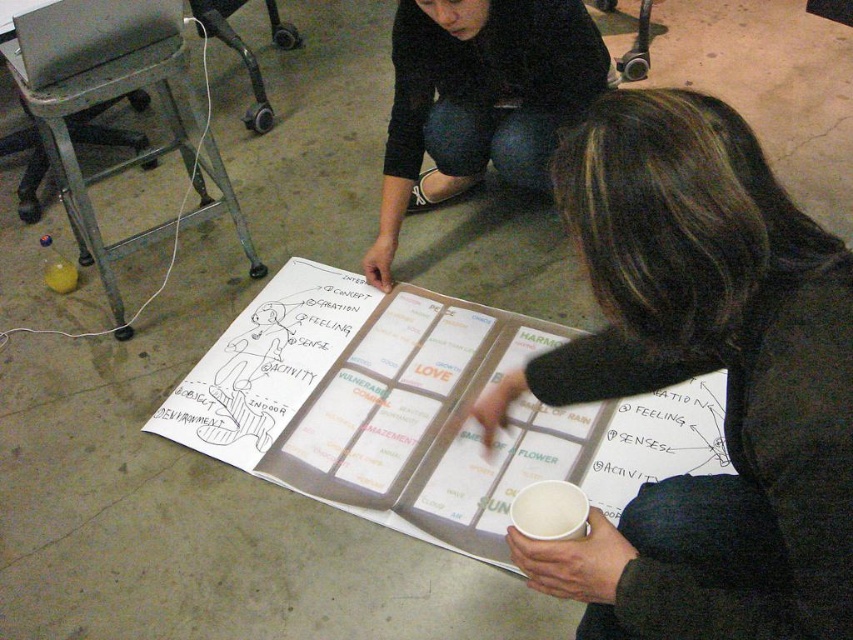
Question: Which object is farther from the camera taking this photo?

Choices:
 (A) black fabric at center
 (B) white paper cup at lower center
 (C) black fabric at lower right

Answer: (A)

Question: Does black fabric at lower right appear over white paper cup at lower center?

Choices:
 (A) no
 (B) yes

Answer: (B)

Question: Is black fabric at lower right to the left of white paper cup at lower center from the viewer's perspective?

Choices:
 (A) yes
 (B) no

Answer: (B)

Question: Which of the following is the closest to the observer?

Choices:
 (A) (553, 493)
 (B) (596, 35)
 (C) (763, 396)

Answer: (C)

Question: Which point is farther to the camera?

Choices:
 (A) black fabric at center
 (B) black fabric at lower right
 (C) white paper cup at lower center

Answer: (A)

Question: Can you confirm if black fabric at lower right is positioned to the left of black fabric at center?

Choices:
 (A) yes
 (B) no

Answer: (B)